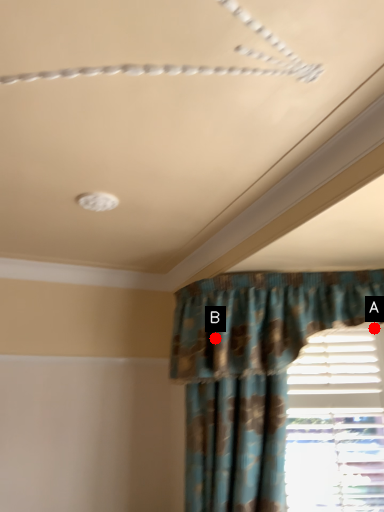
Question: Two points are circled on the image, labeled by A and B beside each circle. Which of the following is the farthest from the observer?

Choices:
 (A) A is further
 (B) B is further

Answer: (A)